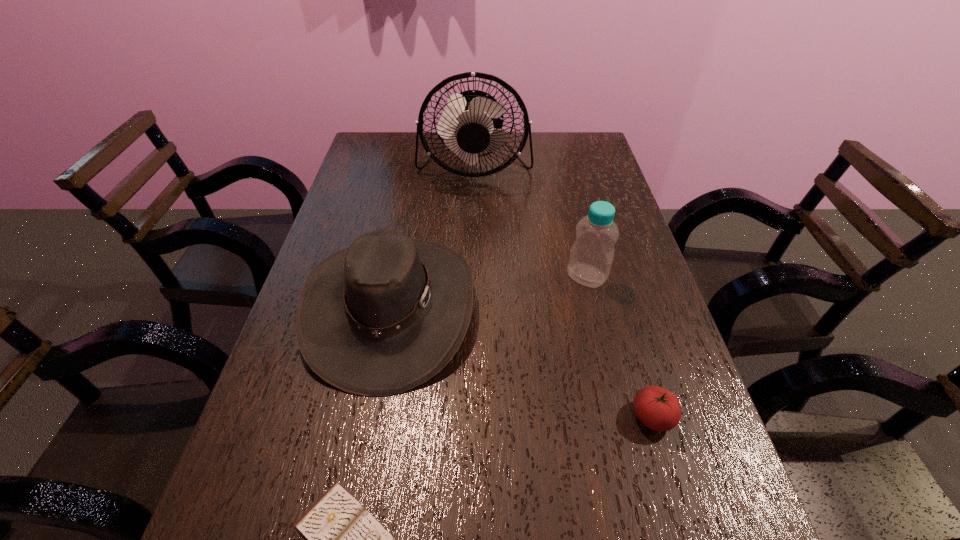
Locate an element on the screen. Image resolution: width=960 pixels, height=540 pixels. blank area in the image that satisfies the following two spatial constraints: 1. in front of the tallest object, directing airflow; 2. on the right side of the fourth shortest object is located at coordinates (472, 276).

The width and height of the screenshot is (960, 540). I want to click on vacant space that satisfies the following two spatial constraints: 1. on the back side of the tomato; 2. on the front-facing side of the third shortest object, so click(x=620, y=308).